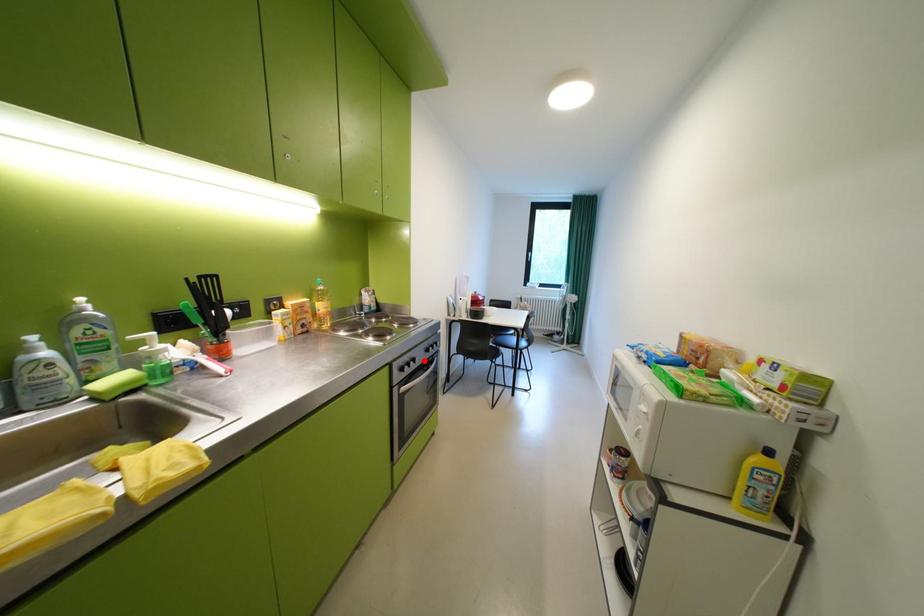
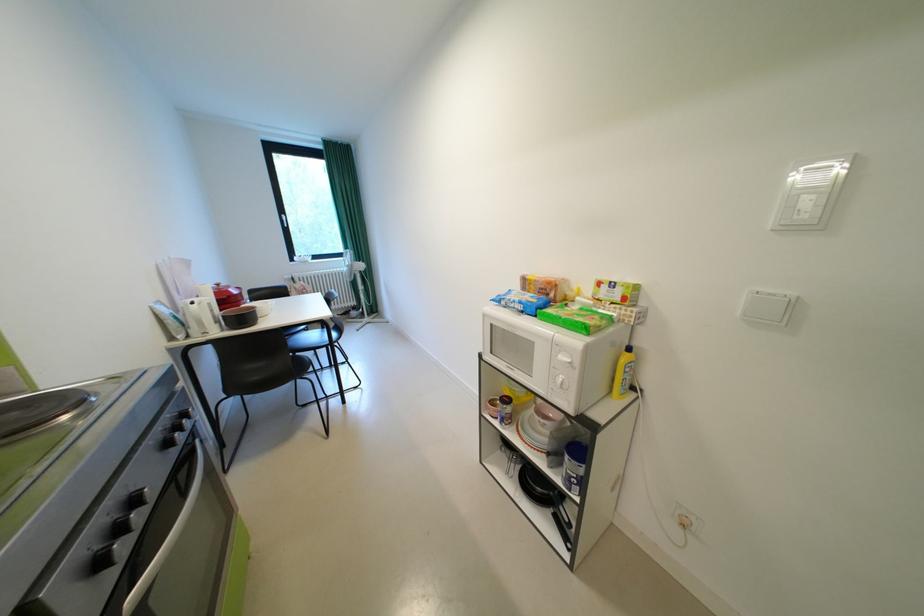
The point at the highlighted location is marked in the first image. Where is the corresponding point in the second image?

(146, 501)